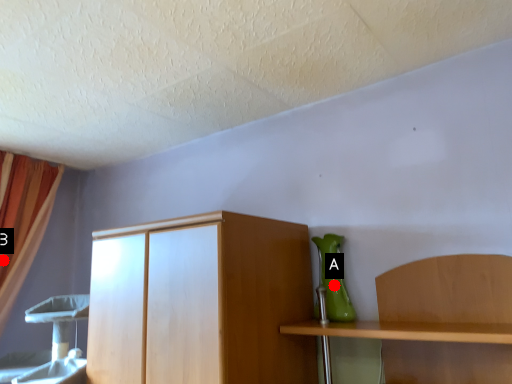
Question: Two points are circled on the image, labeled by A and B beside each circle. Which of the following is the farthest from the observer?

Choices:
 (A) A is further
 (B) B is further

Answer: (B)